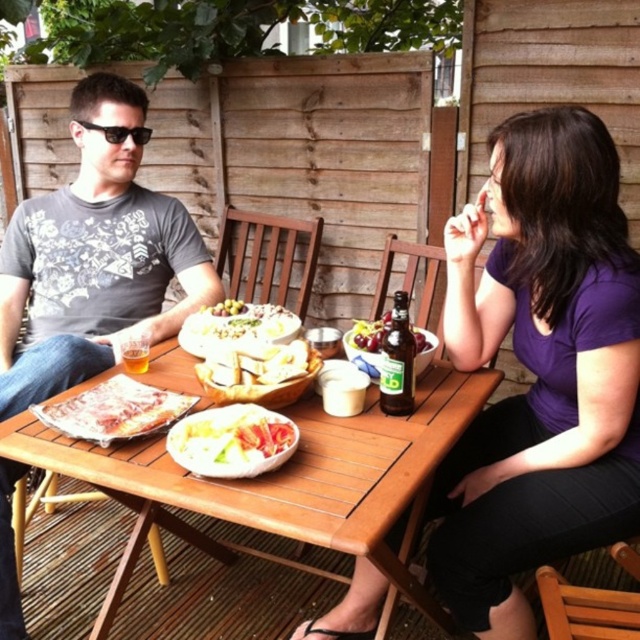
Between matte gray t-shirt at left and wooden table at center, which one appears on the right side from the viewer's perspective?

wooden table at center

Can you confirm if matte gray t-shirt at left is smaller than wooden table at center?

Indeed, matte gray t-shirt at left has a smaller size compared to wooden table at center.

Does point (54, 225) come in front of point (376, 499)?

No, (54, 225) is further to viewer.

This screenshot has width=640, height=640. In order to click on matte gray t-shirt at left in this screenshot , I will do `click(93, 257)`.

Which of these two, purple matte shirt at center or white glossy plate at center, stands shorter?

white glossy plate at center is shorter.

Is point (554, 291) positioned before point (291, 449)?

That is False.

Image resolution: width=640 pixels, height=640 pixels. Identify the location of purple matte shirt at center. (540, 369).

Is wooden table at center below white glossy plate at center?

Correct, wooden table at center is located below white glossy plate at center.

In the scene shown: Does wooden table at center have a lesser height compared to white glossy plate at center?

No, wooden table at center is not shorter than white glossy plate at center.

Is point (384, 532) positioned before point (275, 465)?

Yes, it is in front of point (275, 465).

Where is `wooden table at center`? This screenshot has width=640, height=640. wooden table at center is located at coordinates (282, 481).